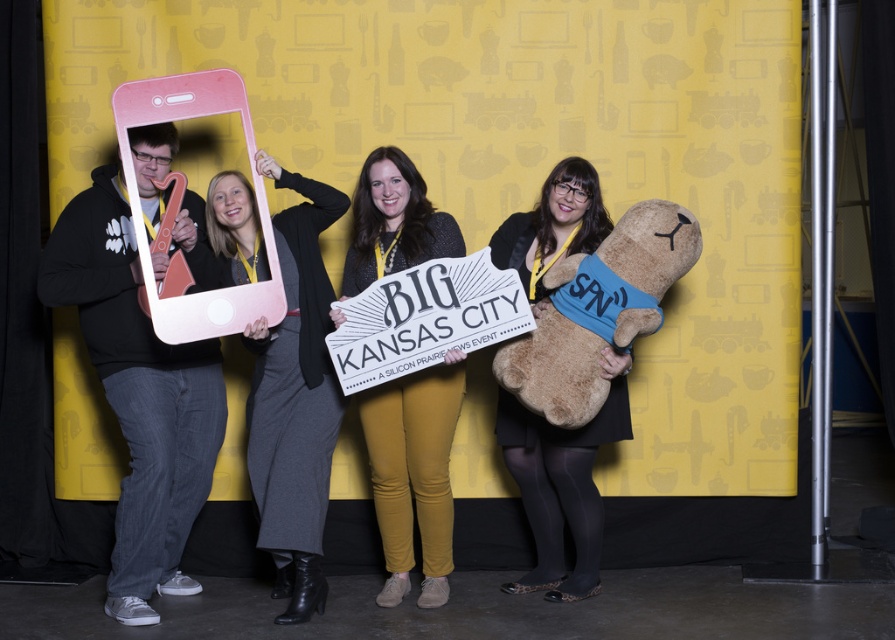
Is matte pink phone at left closer to camera compared to gray woolen pants at center?

Yes.

Does matte pink phone at left appear on the right side of gray woolen pants at center?

Incorrect, matte pink phone at left is not on the right side of gray woolen pants at center.

Where is `matte pink phone at left`? This screenshot has height=640, width=895. matte pink phone at left is located at coordinates (138, 394).

Image resolution: width=895 pixels, height=640 pixels. Identify the location of matte pink phone at left. (138, 394).

Is matte black teddy bear at center further to the viewer compared to brown plush at right?

Yes.

Can you confirm if matte black teddy bear at center is thinner than brown plush at right?

Correct, matte black teddy bear at center's width is less than brown plush at right's.

This screenshot has height=640, width=895. Describe the element at coordinates (561, 483) in the screenshot. I see `matte black teddy bear at center` at that location.

In order to click on matte black teddy bear at center in this screenshot , I will do `click(561, 483)`.

Between gray woolen pants at center and mustard yellow leggings at center, which one has more height?

gray woolen pants at center

Find the location of a particular element. gray woolen pants at center is located at coordinates (294, 400).

The width and height of the screenshot is (895, 640). Identify the location of gray woolen pants at center. (294, 400).